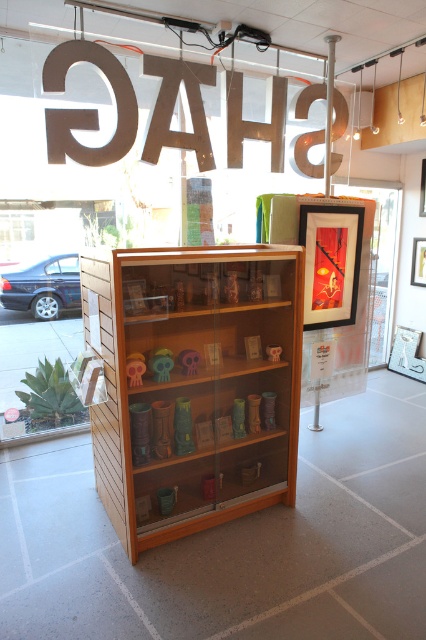
Question: Which of the following is the farthest from the observer?

Choices:
 (A) transparent glass door at center
 (B) wooden shelf at center

Answer: (A)

Question: Is wooden shelf at center below transparent glass door at center?

Choices:
 (A) yes
 (B) no

Answer: (A)

Question: Is wooden shelf at center to the right of transparent glass door at center from the viewer's perspective?

Choices:
 (A) yes
 (B) no

Answer: (B)

Question: Does wooden shelf at center have a lesser width compared to transparent glass door at center?

Choices:
 (A) yes
 (B) no

Answer: (B)